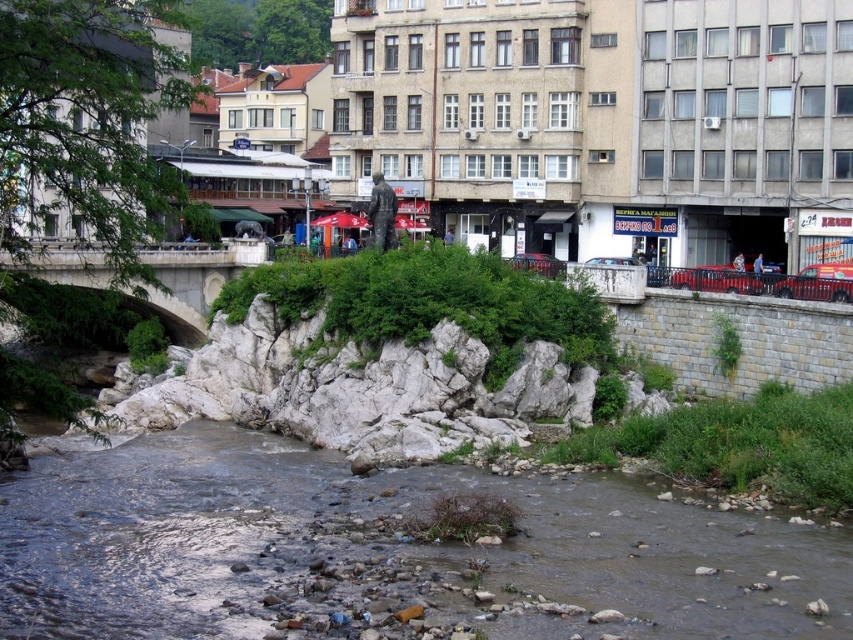
Question: From the image, what is the correct spatial relationship of brown rocky riverbed at lower center in relation to white stone bridge at left?

Choices:
 (A) right
 (B) left

Answer: (A)

Question: Does brown rocky riverbed at lower center appear over white stone bridge at left?

Choices:
 (A) yes
 (B) no

Answer: (B)

Question: Observing the image, what is the correct spatial positioning of brown rocky riverbed at lower center in reference to white stone bridge at left?

Choices:
 (A) left
 (B) right

Answer: (B)

Question: Which of the following is the closest to the observer?

Choices:
 (A) white stone bridge at left
 (B) brown rocky riverbed at lower center

Answer: (B)